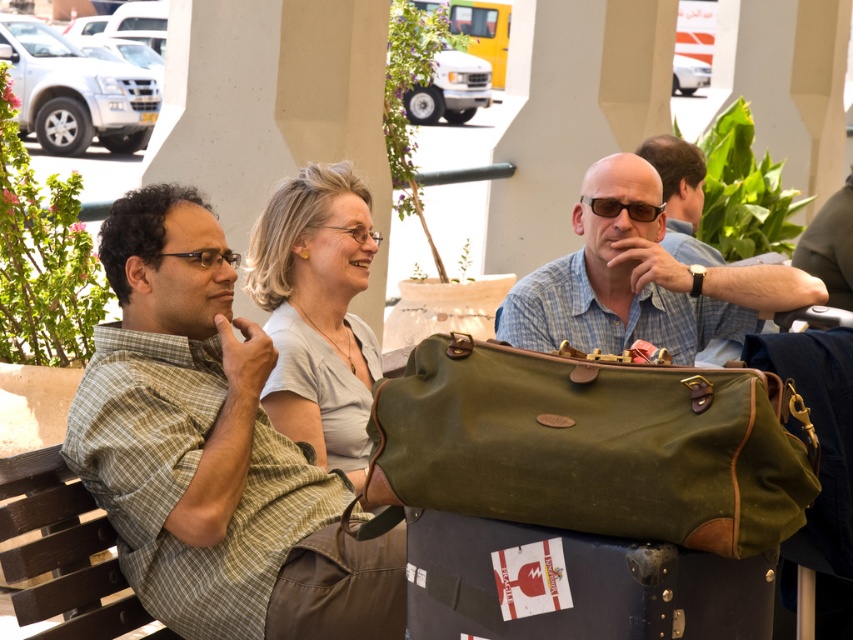
Question: Can you confirm if olive green waxed canvas duffel bag at center is positioned above matte green leather suitcase at center?

Choices:
 (A) no
 (B) yes

Answer: (B)

Question: Does white smooth pillar at center appear over matte green duffel bag at center?

Choices:
 (A) yes
 (B) no

Answer: (A)

Question: Is olive green waxed canvas duffel bag at center closer to camera compared to matte green duffel bag at center?

Choices:
 (A) yes
 (B) no

Answer: (A)

Question: Estimate the real-world distances between objects in this image. Which object is closer to the green plaid shirt at left?

Choices:
 (A) olive green waxed canvas duffel bag at center
 (B) matte green duffel bag at center

Answer: (A)

Question: Which object appears closest to the camera in this image?

Choices:
 (A) olive green waxed canvas duffel bag at center
 (B) matte green duffel bag at center
 (C) green plaid shirt at left

Answer: (A)

Question: Which point is farther to the camera?

Choices:
 (A) matte green duffel bag at center
 (B) white smooth pillar at center
 (C) brown wooden park bench at lower left

Answer: (B)